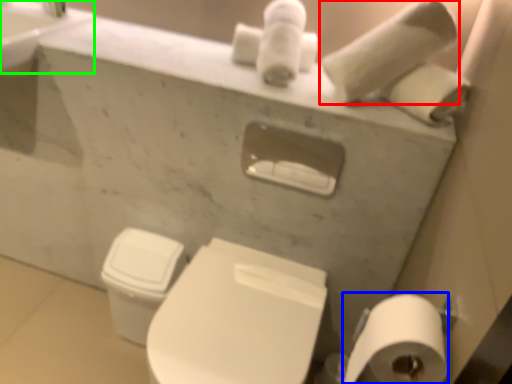
Question: Estimate the real-world distances between objects in this image. Which object is farther from toilet paper (highlighted by a red box), toilet paper (highlighted by a blue box) or sink (highlighted by a green box)?

Choices:
 (A) toilet paper
 (B) sink

Answer: (B)